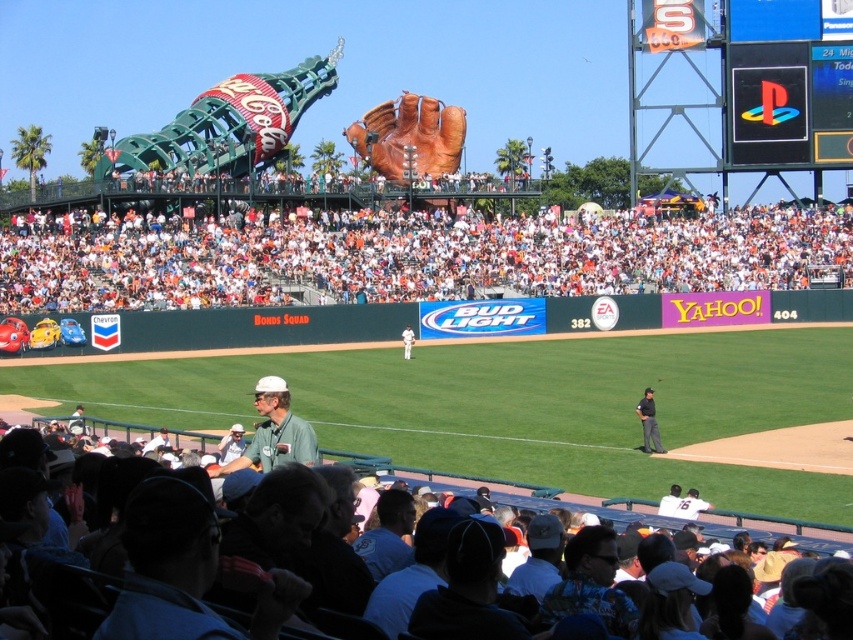
Consider the image. Who is more distant from viewer, [303,440] or [402,336]?

The point [402,336] is more distant.

Describe the element at coordinates (274, 433) in the screenshot. I see `green matte shirt at center` at that location.

What do you see at coordinates (274, 433) in the screenshot? Image resolution: width=853 pixels, height=640 pixels. I see `green matte shirt at center` at bounding box center [274, 433].

Identify the location of green matte shirt at center. The width and height of the screenshot is (853, 640). (274, 433).

Between point (606, 572) and point (648, 403), which one is positioned in front?

Positioned in front is point (606, 572).

The image size is (853, 640). Describe the element at coordinates (590, 582) in the screenshot. I see `camouflage shirt at lower center` at that location.

Which is behind, point (598, 557) or point (636, 413)?

Positioned behind is point (636, 413).

Identify the location of camouflage shirt at lower center. (590, 582).

Between green matte shirt at center and light blue shirt at lower center, which one has less height?

light blue shirt at lower center

What do you see at coordinates (274, 433) in the screenshot? The height and width of the screenshot is (640, 853). I see `green matte shirt at center` at bounding box center [274, 433].

I want to click on green matte shirt at center, so click(x=274, y=433).